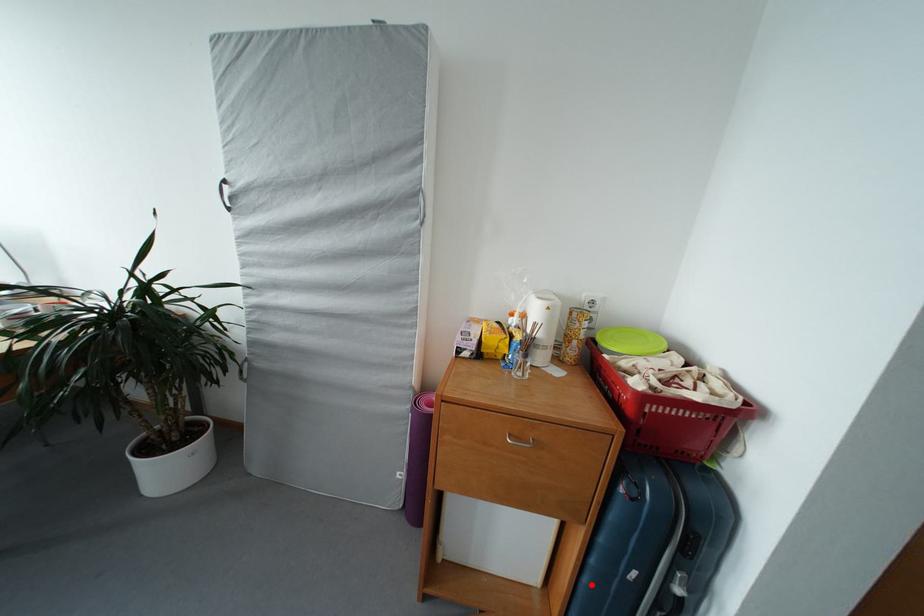
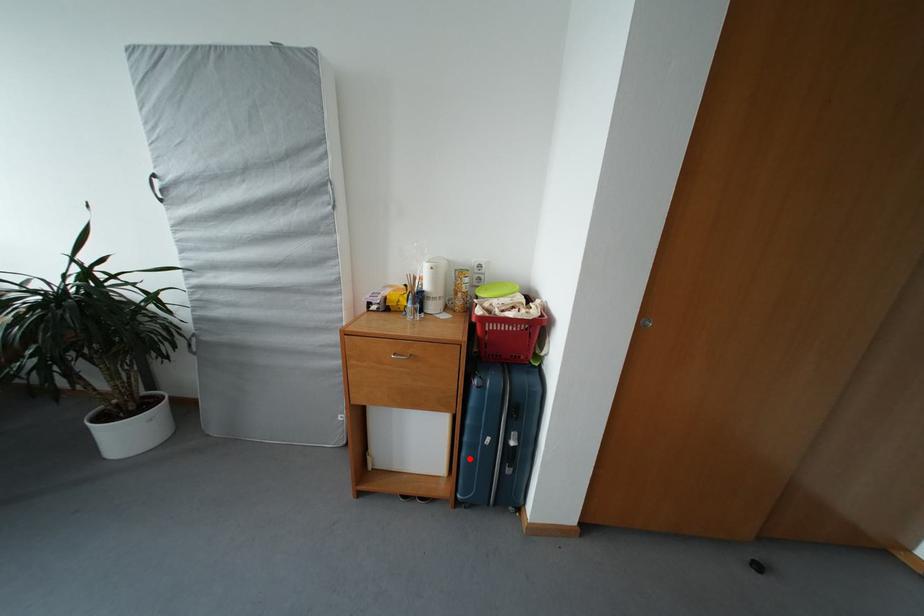
I am providing you with two images of the same scene from different viewpoints. A red point is marked on the first image and another point is marked on the second image. Is the marked point in image1 the same physical position as the marked point in image2?

Yes